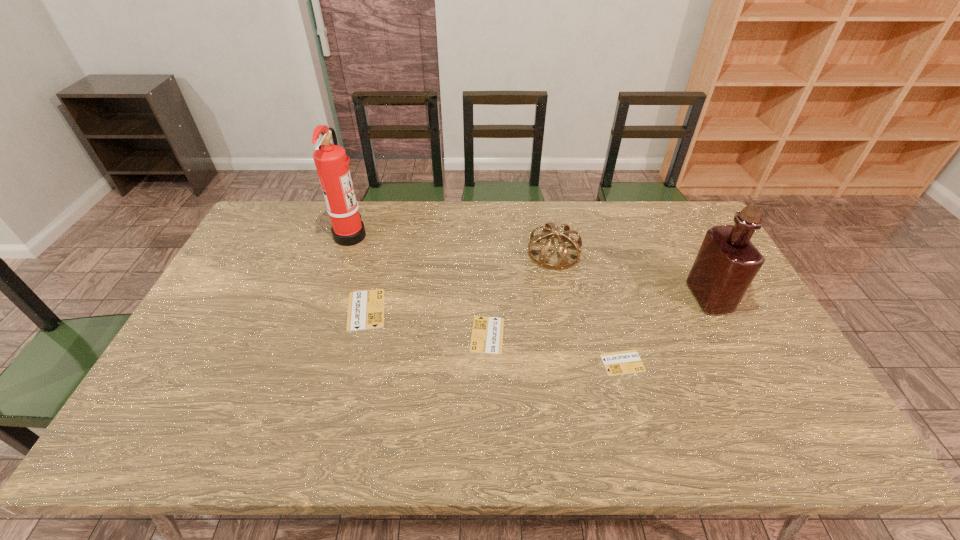
The height and width of the screenshot is (540, 960). Find the location of `unoccupied area between the second identity card from left to right and the second tallest object`. unoccupied area between the second identity card from left to right and the second tallest object is located at coordinates (598, 316).

Where is `empty space that is in between the rightmost identity card and the fifth tallest object`? This screenshot has height=540, width=960. empty space that is in between the rightmost identity card and the fifth tallest object is located at coordinates (555, 349).

This screenshot has height=540, width=960. What are the coordinates of `free spot between the tiara and the third object from left to right` in the screenshot? It's located at (520, 294).

The height and width of the screenshot is (540, 960). I want to click on free space between the second identity card from left to right and the third shortest object, so click(x=427, y=322).

Where is `free space that is in between the fifth shortest object and the fourth object from right to left`? The image size is (960, 540). free space that is in between the fifth shortest object and the fourth object from right to left is located at coordinates coord(598,316).

The height and width of the screenshot is (540, 960). In order to click on free space between the rightmost identity card and the fourth object from right to left in this screenshot , I will do `click(555, 349)`.

Select which object is the fifth closest to the tallest object. Please provide its 2D coordinates. Your answer should be formatted as a tuple, i.e. [(x, y)], where the tuple contains the x and y coordinates of a point satisfying the conditions above.

[(727, 262)]

The image size is (960, 540). Find the location of `the third closest object to the shortest object`. the third closest object to the shortest object is located at coordinates (563, 264).

Select which identity card is the second closest to the third tallest object. Please provide its 2D coordinates. Your answer should be formatted as a tuple, i.e. [(x, y)], where the tuple contains the x and y coordinates of a point satisfying the conditions above.

[(624, 362)]

In order to click on identity card that is the closest to the second object from left to right in this screenshot , I will do `click(487, 334)`.